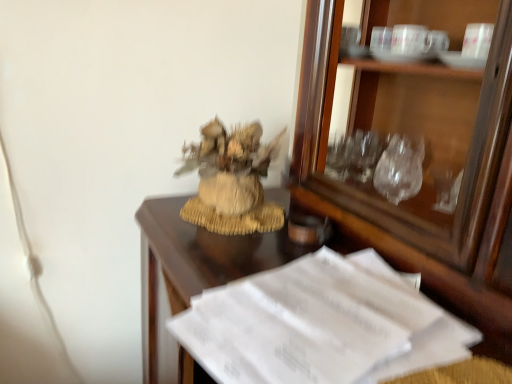
Question: From a real-world perspective, is white paper at lower right positioned above or below burlap textured houseplant at center?

Choices:
 (A) below
 (B) above

Answer: (A)

Question: From their relative heights in the image, would you say white paper at lower right is taller or shorter than burlap textured houseplant at center?

Choices:
 (A) tall
 (B) short

Answer: (B)

Question: Which of these objects is positioned farthest from the matte brown glass at center?

Choices:
 (A) white paper at lower right
 (B) burlap textured houseplant at center

Answer: (A)

Question: Based on their relative distances, which object is nearer to the burlap textured houseplant at center?

Choices:
 (A) matte brown glass at center
 (B) white paper at lower right

Answer: (B)